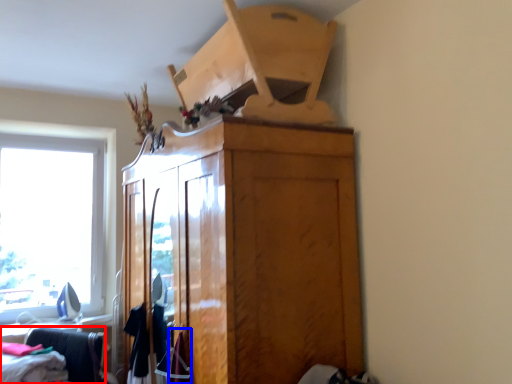
Question: Which object appears farthest to the camera in this image, furniture (highlighted by a red box) or clothing (highlighted by a blue box)?

Choices:
 (A) furniture
 (B) clothing

Answer: (A)